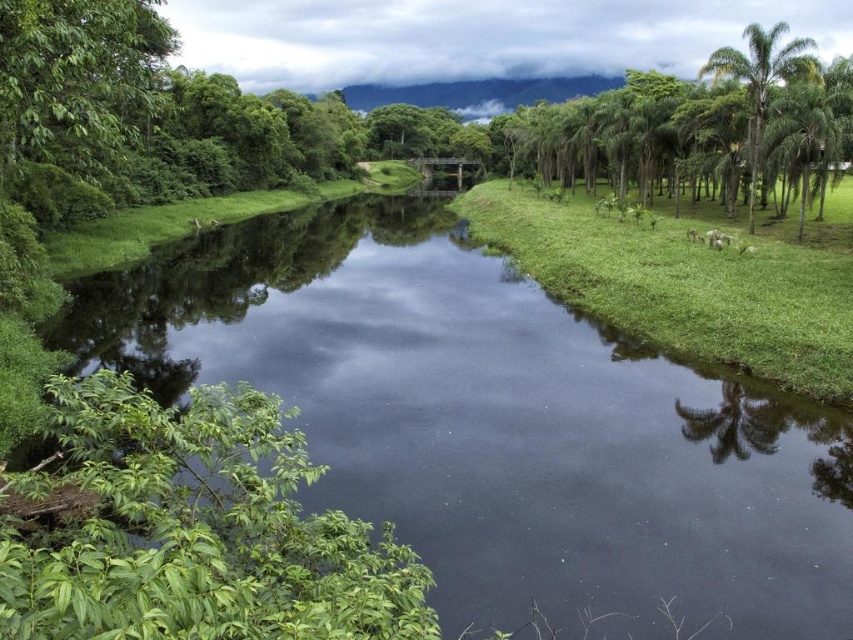
Between green grassy stream at center and green leafy palm tree at right, which one appears on the left side from the viewer's perspective?

From the viewer's perspective, green grassy stream at center appears more on the left side.

Does green grassy stream at center appear over green leafy palm tree at right?

No.

Between point (412, 266) and point (805, 99), which one is positioned in front?

Positioned in front is point (805, 99).

Identify the location of green grassy stream at center. The width and height of the screenshot is (853, 640). (498, 422).

Which is above, green grassy at right or green leafy palm tree at right?

green leafy palm tree at right is above.

Can you confirm if green grassy at right is bigger than green leafy palm tree at right?

Indeed, green grassy at right has a larger size compared to green leafy palm tree at right.

Locate an element on the screen. This screenshot has width=853, height=640. green grassy at right is located at coordinates (680, 284).

At what (x,y) coordinates should I click in order to perform the action: click on green grassy at right. Please return your answer as a coordinate pair (x, y). The width and height of the screenshot is (853, 640). Looking at the image, I should click on (680, 284).

Between point (345, 323) and point (577, 275), which one is positioned behind?

The point (577, 275) is behind.

In the scene shown: Can you confirm if green grassy stream at center is positioned to the left of green grassy at right?

Correct, you'll find green grassy stream at center to the left of green grassy at right.

This screenshot has height=640, width=853. Describe the element at coordinates (498, 422) in the screenshot. I see `green grassy stream at center` at that location.

What are the coordinates of `green grassy stream at center` in the screenshot? It's located at (498, 422).